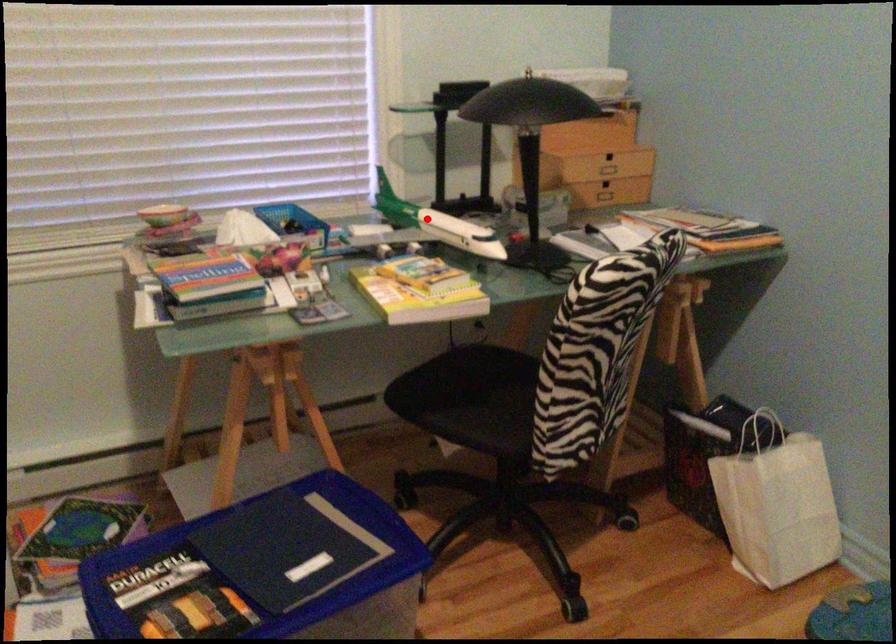
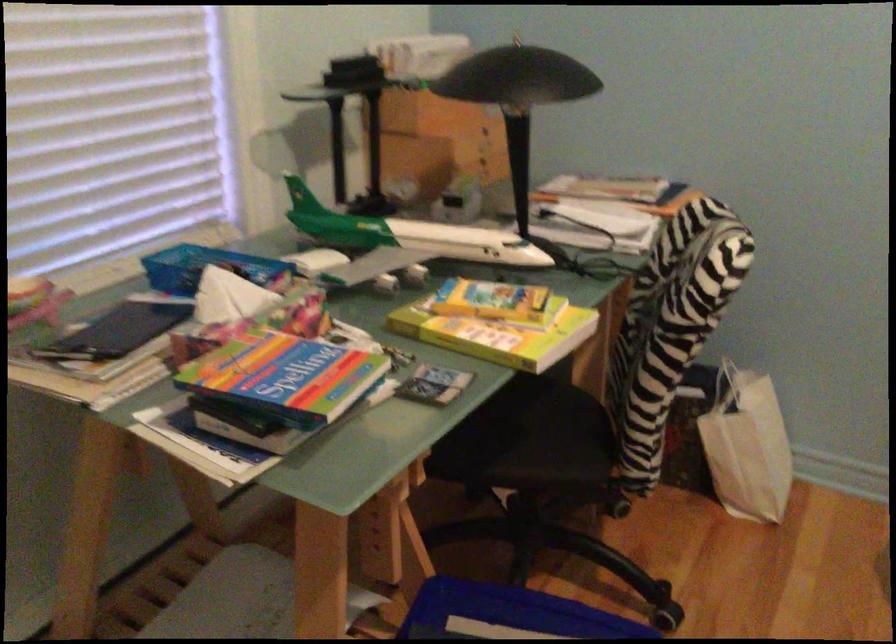
Question: I am providing you with two images of the same scene from different viewpoints. A red point is marked on the first image. At the location where the point appears in image 1, is it still visible in image 2?

Choices:
 (A) Yes
 (B) No

Answer: (A)